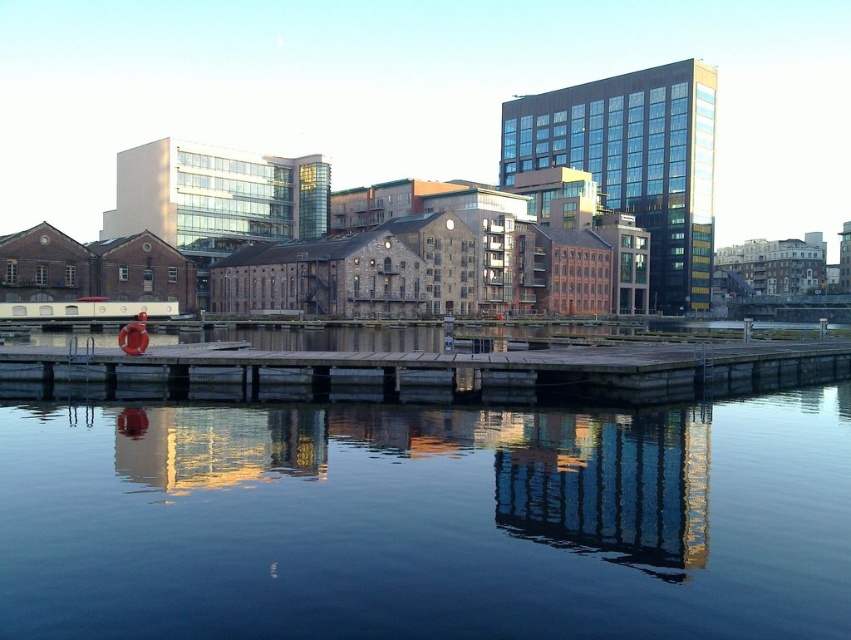
Who is shorter, dark blue water at center or wooden at center?

wooden at center

Is dark blue water at center further to camera compared to wooden at center?

That is False.

Is point (343, 477) positioned behind point (471, 358)?

That is False.

This screenshot has height=640, width=851. I want to click on dark blue water at center, so click(x=427, y=522).